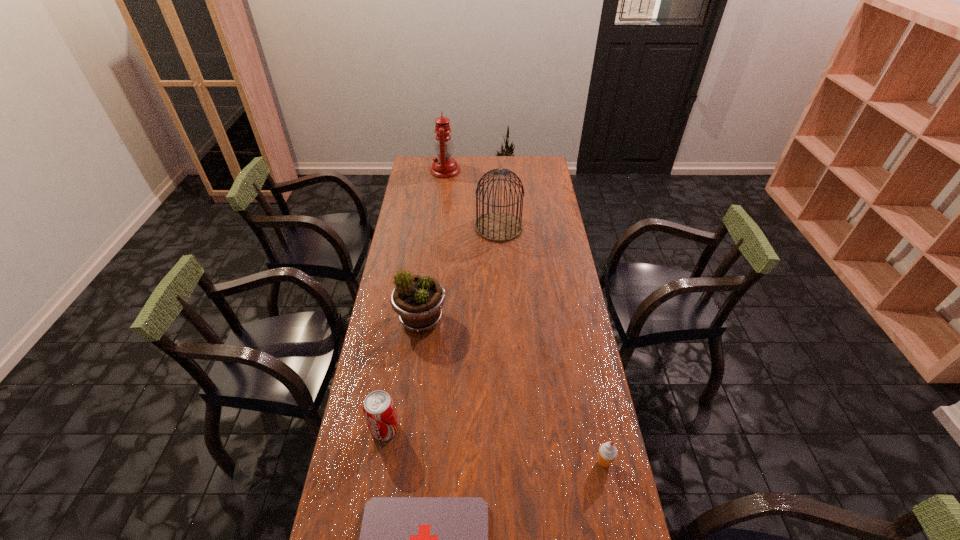
Where is `free point at the right edge`? This screenshot has width=960, height=540. free point at the right edge is located at coordinates (555, 287).

Where is `vacant space at the far left corner`? This screenshot has height=540, width=960. vacant space at the far left corner is located at coordinates coord(420,156).

Identify the location of vacant point located between the soda can and the second nearest object. This screenshot has width=960, height=540. pos(494,446).

Where is `free space between the oil lamp and the flowerpot`? This screenshot has height=540, width=960. free space between the oil lamp and the flowerpot is located at coordinates pos(433,245).

Identify the location of vacant region between the birdcage and the rightmost object. (551, 345).

Find the location of a particular element. vacant area between the rightmost object and the oil lamp is located at coordinates (524, 316).

Select which object is the fifth closest to the soda can. Please provide its 2D coordinates. Your answer should be formatted as a tuple, i.e. [(x, y)], where the tuple contains the x and y coordinates of a point satisfying the conditions above.

[(444, 166)]

You are a GUI agent. You are given a task and a screenshot of the screen. Output one action in this format:
    pyautogui.click(x=<x>, y=<y>)
    Task: Click on the object that can be found as the second closest to the shortest object
    This screenshot has width=960, height=540.
    Given the screenshot: What is the action you would take?
    pyautogui.click(x=607, y=453)

Find the location of a particular element. This screenshot has height=540, width=960. vacant area that satisfies the following two spatial constraints: 1. at the door of the birdcage; 2. on the left side of the second shortest object is located at coordinates (511, 462).

This screenshot has height=540, width=960. I want to click on free space that satisfies the following two spatial constraints: 1. on the back side of the fourth shortest object; 2. on the left side of the oil lamp, so click(x=440, y=170).